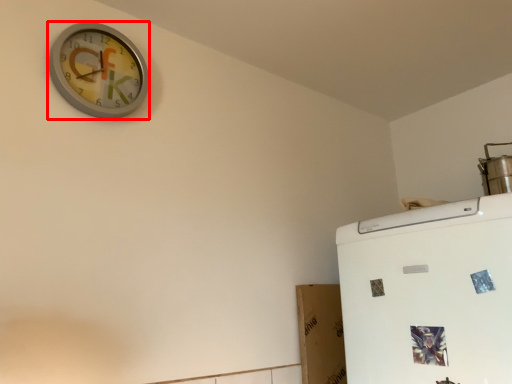
Question: From the image's perspective, considering the relative positions of wall clock (annotated by the red box) and appliance in the image provided, where is wall clock (annotated by the red box) located with respect to the staircase?

Choices:
 (A) above
 (B) below

Answer: (A)